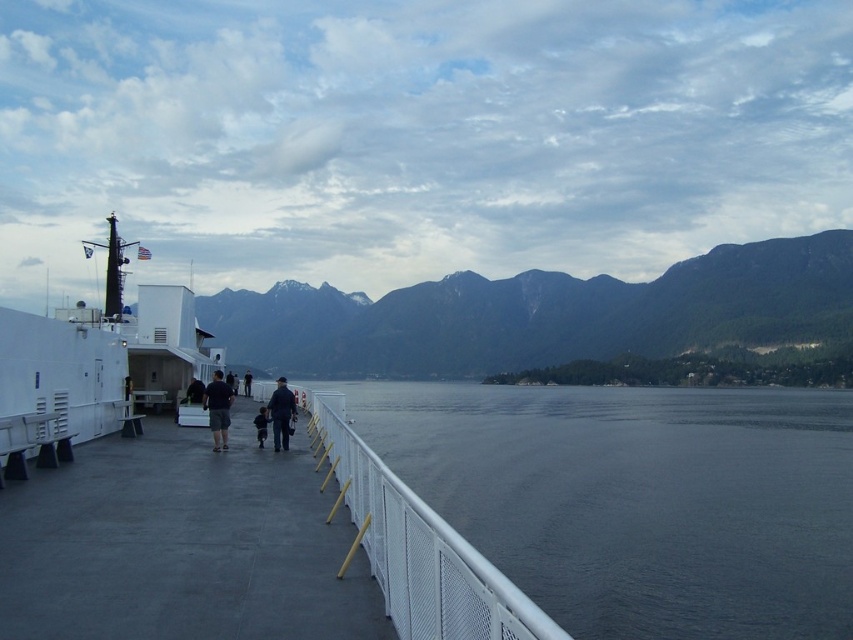
Who is more distant from viewer, (190, 381) or (245, 388)?

The point (245, 388) is more distant.

Is dark blue fabric jacket at center wider than dark gray fabric jacket at center?

No.

Where is `dark blue fabric jacket at center`? The height and width of the screenshot is (640, 853). dark blue fabric jacket at center is located at coordinates (194, 392).

Is dark gray fabric jacket at center wider than black fabric jacket at center?

Yes, dark gray fabric jacket at center is wider than black fabric jacket at center.

The image size is (853, 640). What do you see at coordinates (247, 381) in the screenshot?
I see `dark gray fabric jacket at center` at bounding box center [247, 381].

Where is `dark gray fabric jacket at center`? dark gray fabric jacket at center is located at coordinates (247, 381).

Who is lower down, dark blue water at center or dark blue fabric at center?

dark blue water at center is below.

In the scene shown: Can you confirm if dark blue water at center is smaller than dark blue fabric at center?

Actually, dark blue water at center might be larger than dark blue fabric at center.

Which is behind, point (592, 432) or point (264, 404)?

Point (592, 432)

Where is `dark blue water at center`? dark blue water at center is located at coordinates (637, 499).